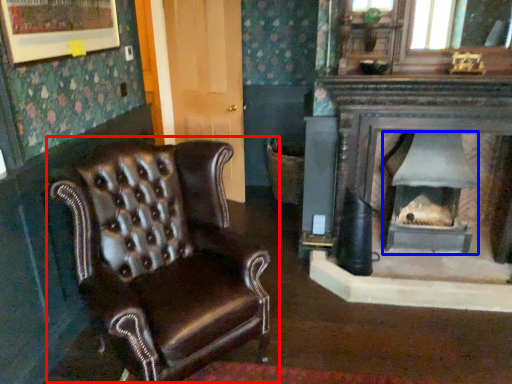
Question: Which object appears farthest to the camera in this image, chair (highlighted by a red box) or wood burning stove (highlighted by a blue box)?

Choices:
 (A) chair
 (B) wood burning stove

Answer: (B)